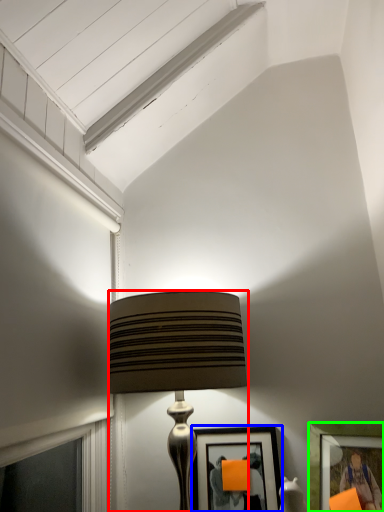
Question: Considering the real-world distances, which object is farthest from lamp (highlighted by a red box)? picture frame (highlighted by a blue box) or picture frame (highlighted by a green box)?

Choices:
 (A) picture frame
 (B) picture frame

Answer: (B)